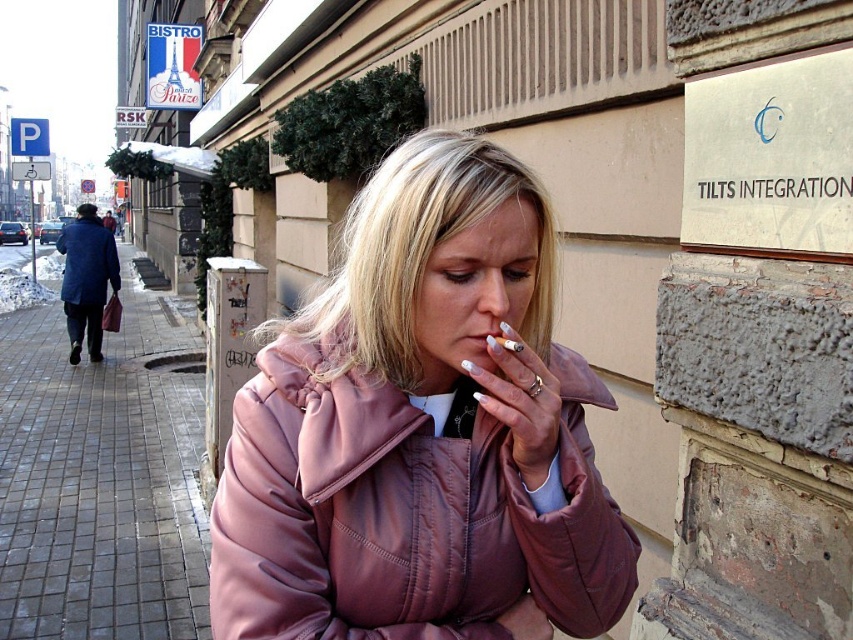
You are a delivery robot navigating an urban street. You need to deliver a package to the person wearing a matte pink leather jacket at center. Your current position is at point (422, 432). Can you reach them directly from your current position?

The point (422, 432) is on the matte pink leather jacket at center, so yes, the delivery robot can reach them directly from that position.

You are a delivery person trying to walk from the sidewalk to the beige building. There is a gray brick pavement at lower left and a blue wool coat at left blocking your path. Which object is closer to the ground?

The gray brick pavement at lower left is closer to the ground since it is positioned below the blue wool coat at left.